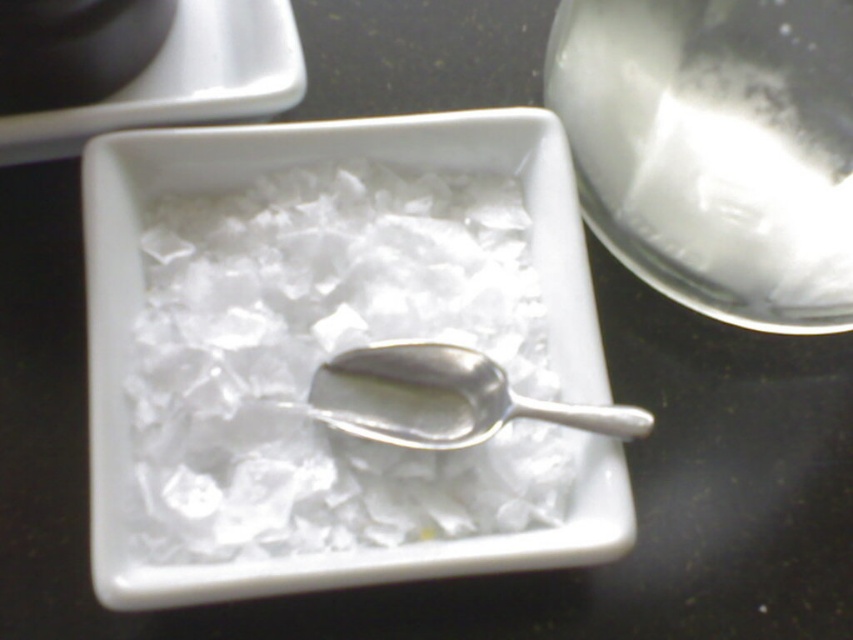
You are organizing items on a kitchen counter and see the clear ice cubes at center and the transparent glass bowl at upper right. Which object is located to the left of the other?

The clear ice cubes at center is positioned on the left side of transparent glass bowl at upper right.

In the scene shown: You are trying to determine which object is taller between the clear ice cubes at center and the silver metallic spoon at center in the bowl. Based on the scene description, which one is taller?

The clear ice cubes at center are taller than the silver metallic spoon at center according to the description.

You are preparing a drink and need to know which container can hold more liquid. Based on the image, which object between the transparent glass bowl at upper right and the silver metallic spoon at center is taller and thus likely to hold more liquid?

The transparent glass bowl at upper right is much taller than the silver metallic spoon at center, so it can hold more liquid.